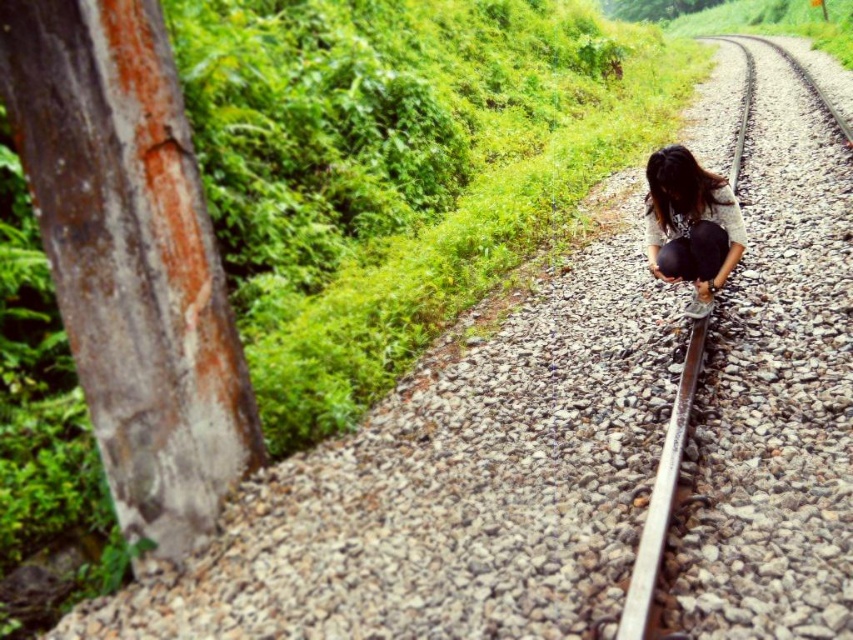
Question: Is matte black bag at center above metal train track at center?

Choices:
 (A) yes
 (B) no

Answer: (B)

Question: Which point is closer to the camera?

Choices:
 (A) (689, 371)
 (B) (674, 428)

Answer: (B)

Question: Does matte black bag at center appear under rusty metal train track at center-right?

Choices:
 (A) no
 (B) yes

Answer: (A)

Question: Which object appears farthest from the camera in this image?

Choices:
 (A) metal train track at center
 (B) rusty metal train track at center-right
 (C) matte black bag at center

Answer: (C)

Question: Can you confirm if metal train track at center is thinner than rusty metal train track at center-right?

Choices:
 (A) yes
 (B) no

Answer: (B)

Question: Which point is closer to the camera?

Choices:
 (A) (671, 454)
 (B) (692, 310)

Answer: (A)